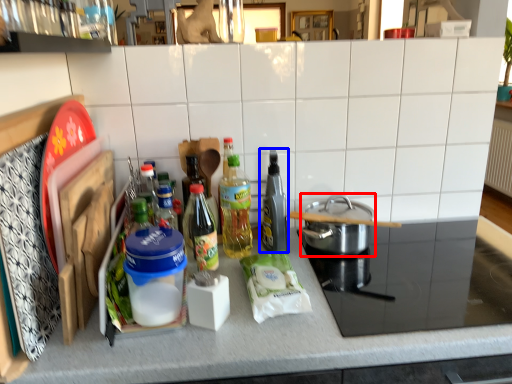
Question: Which point is closer to the camera, kitchen appliance (highlighted by a red box) or bottle (highlighted by a blue box)?

Choices:
 (A) kitchen appliance
 (B) bottle

Answer: (B)